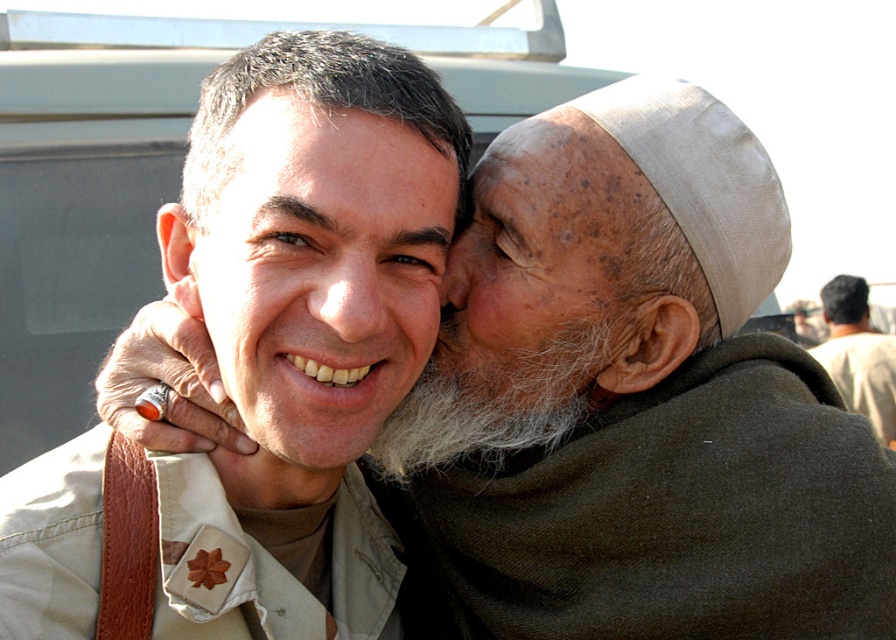
Question: Can you confirm if matte skin forehead at upper center is smaller than beige fabric headscarf at upper right?

Choices:
 (A) no
 (B) yes

Answer: (B)

Question: Which object is farther from the camera taking this photo?

Choices:
 (A) dry skin ear at center
 (B) beige fabric headscarf at upper right

Answer: (B)

Question: Which point is farther from the camera taking this photo?

Choices:
 (A) (507, 282)
 (B) (639, 384)
 (C) (476, 458)

Answer: (C)

Question: Considering the relative positions of beige uniform at center and matte skin forehead at upper center in the image provided, where is beige uniform at center located with respect to matte skin forehead at upper center?

Choices:
 (A) above
 (B) below

Answer: (B)

Question: Which of the following is the farthest from the observer?

Choices:
 (A) matte khaki uniform at center
 (B) white fluffy beard at center
 (C) beige uniform at center

Answer: (B)

Question: Does matte khaki uniform at center appear over dry skin ear at center?

Choices:
 (A) no
 (B) yes

Answer: (B)